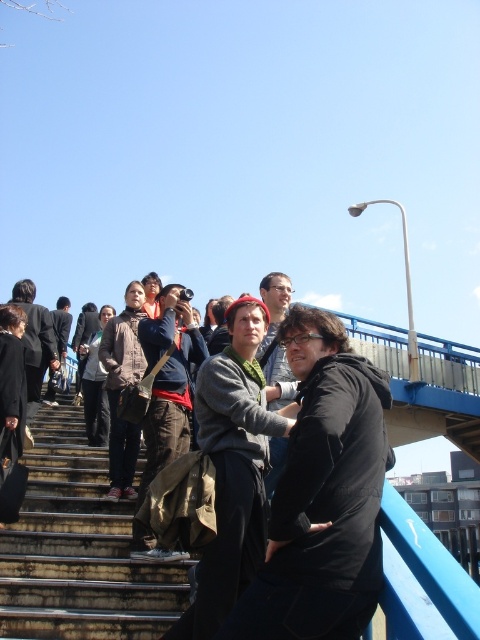
Is dark gray hoodie at center smaller than rusty metal stairs at lower left?

Incorrect, dark gray hoodie at center is not smaller in size than rusty metal stairs at lower left.

Which is behind, point (21, 620) or point (79, 548)?

Positioned behind is point (79, 548).

Where is `dark gray hoodie at center`? dark gray hoodie at center is located at coordinates (79, 548).